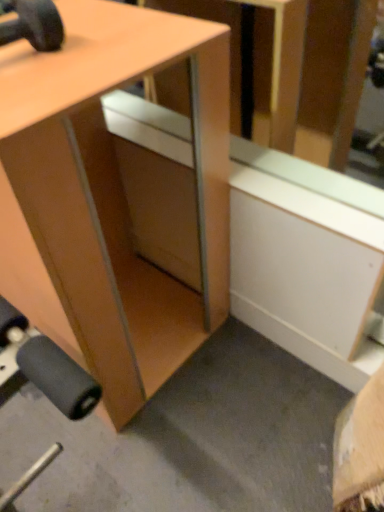
You are a GUI agent. You are given a task and a screenshot of the screen. Output one action in this format:
    pyautogui.click(x=<x>, y=<y>)
    Task: Click on the unoccupied region to the right of matte black dumbbell at upper left
    
    Given the screenshot: What is the action you would take?
    pyautogui.click(x=94, y=51)